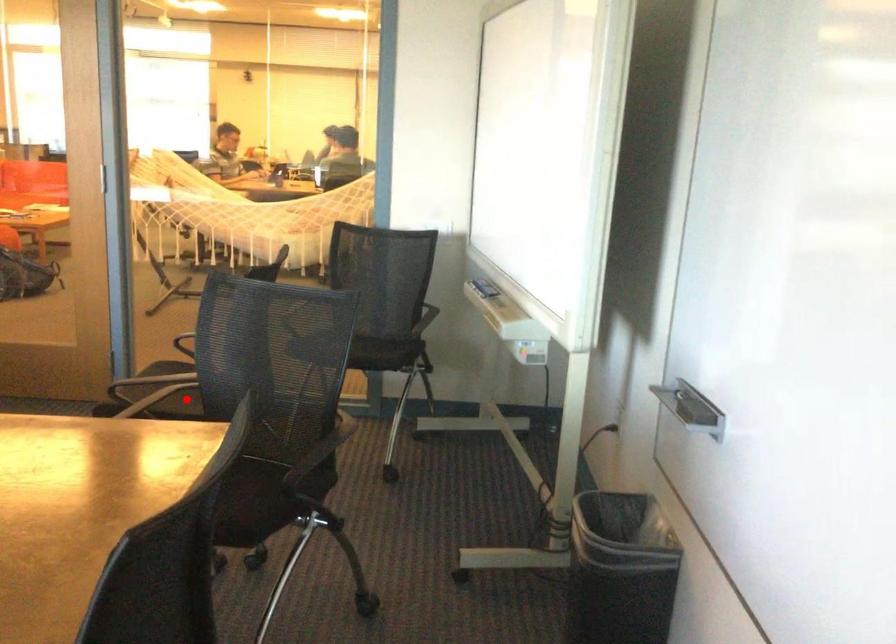
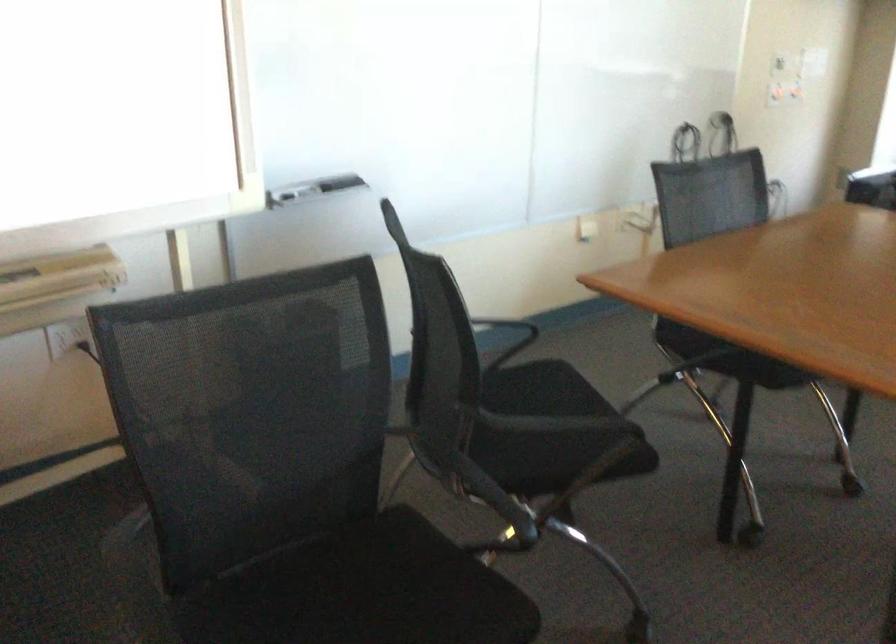
Question: I am providing you with two images of the same scene from different viewpoints. In image1, a red point is highlighted. Considering the same 3D point in image2, which of the following is correct?

Choices:
 (A) It is closer
 (B) It is farther

Answer: (A)